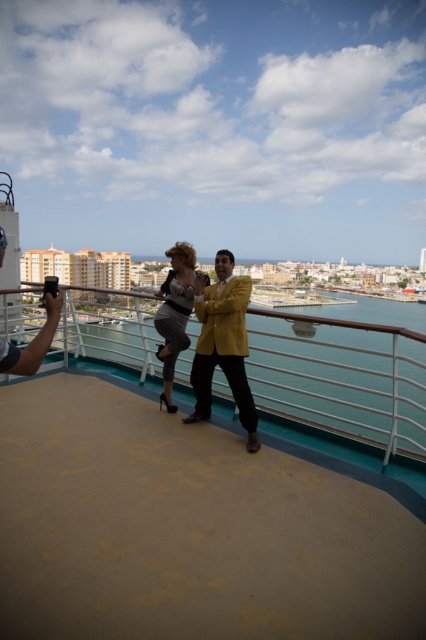
You are a photographer trying to capture a group photo of the shiny yellow blazer at center and the shiny silver dress at center. Based on their sizes, which one should you position closer to the camera to ensure both appear equally sized in the photo?

The shiny yellow blazer at center is narrower than the shiny silver dress at center, so you should position the shiny yellow blazer at center closer to the camera to make them appear the same size in the photo.

You are a photographer on the cruise ship deck. You need to capture a photo where the blue glossy water at center is visible to the right of the shiny yellow blazer at center. Is this possible based on the current arrangement?

Yes, because the blue glossy water at center is positioned on the right side of the shiny yellow blazer at center, so the water will naturally appear to the right of the blazer in the photo.

You are standing on the deck of the cruise ship and looking down. Where exactly can you see the blue glossy water at center?

The blue glossy water at center is located at point coordinates of 0.592 on the x axis and 0.805 on the y axis.